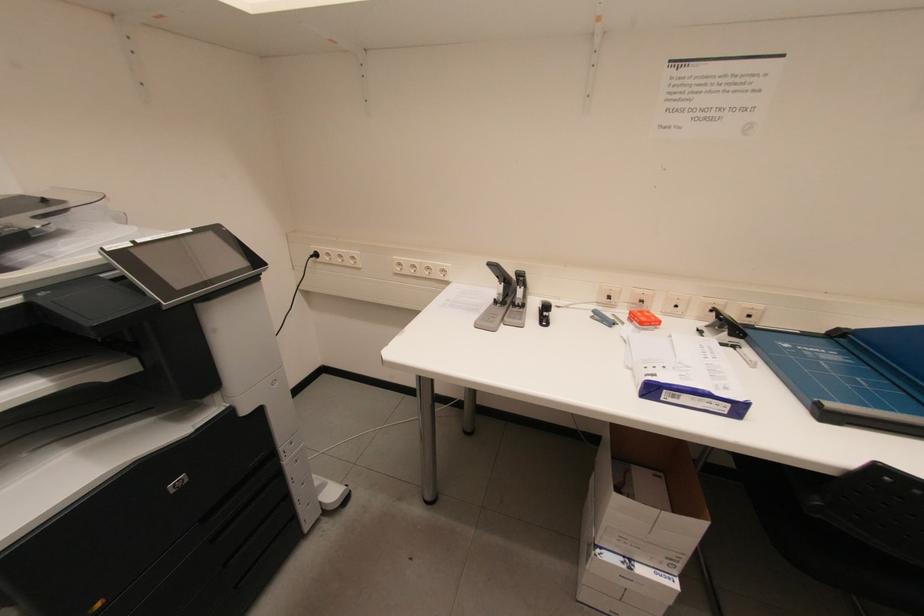
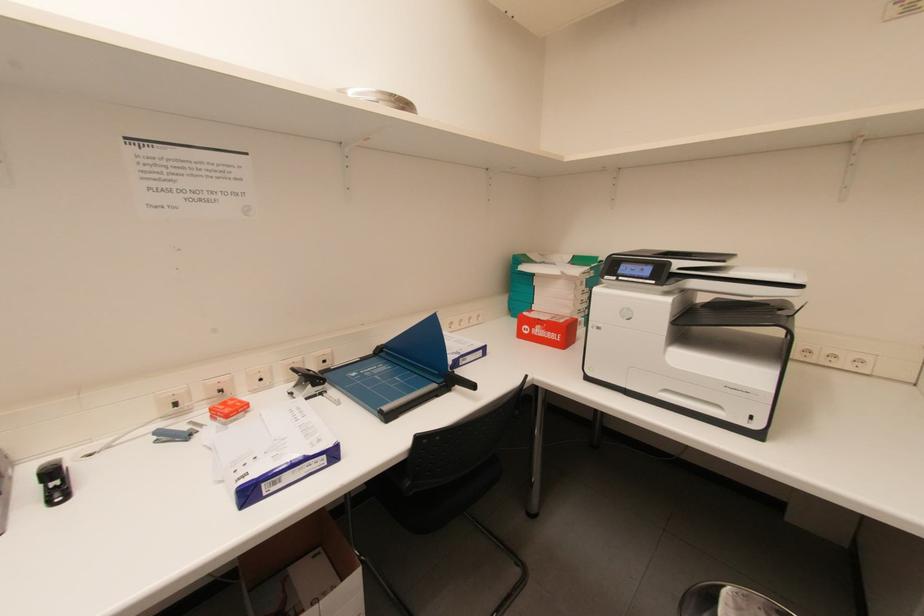
Question: The first image is from the beginning of the video and the second image is from the end. How did the camera likely rotate when shooting the video?

Choices:
 (A) Left
 (B) Right
 (C) Up
 (D) Down

Answer: (B)